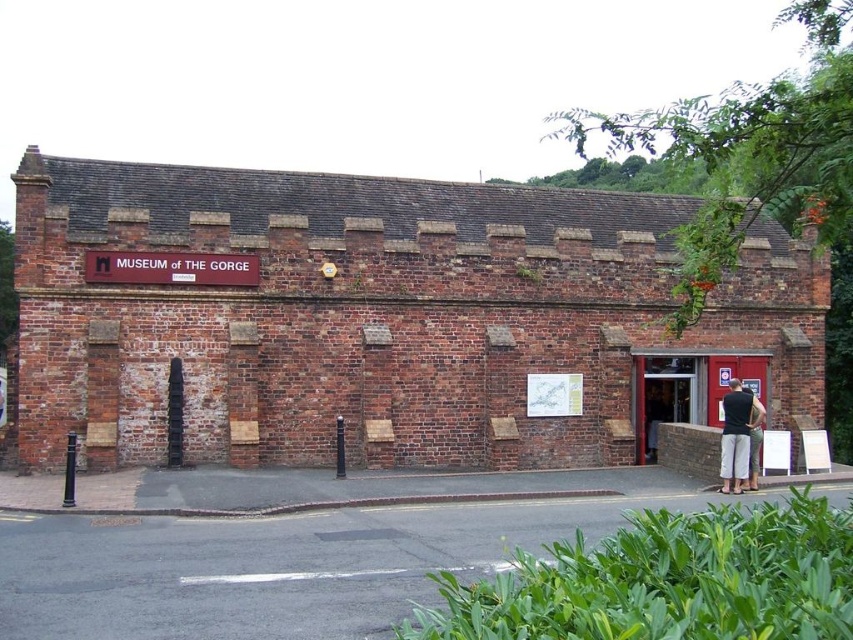
Who is higher up, light gray pants at center or dark gray fabric pants at lower right?

light gray pants at center

Describe the element at coordinates (737, 435) in the screenshot. I see `light gray pants at center` at that location.

From the picture: Who is more forward, [740,451] or [753,413]?

Positioned in front is point [740,451].

The height and width of the screenshot is (640, 853). Identify the location of light gray pants at center. (737, 435).